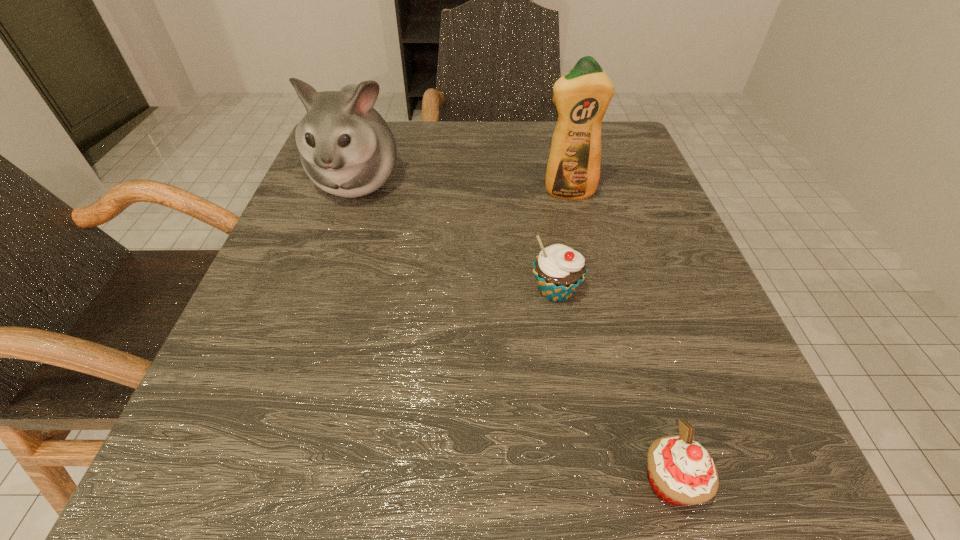
The width and height of the screenshot is (960, 540). Find the location of `vacant area between the shorter cupcake and the detergent`. vacant area between the shorter cupcake and the detergent is located at coordinates (619, 338).

Where is `free space between the third tallest object and the nearest object`? free space between the third tallest object and the nearest object is located at coordinates (613, 387).

Locate an element on the screen. vacant area that lies between the shortest object and the third shortest object is located at coordinates (514, 332).

Where is `vacant space that's between the shortest object and the second shortest object`? This screenshot has height=540, width=960. vacant space that's between the shortest object and the second shortest object is located at coordinates (613, 387).

Locate which object ranks second in proximity to the right cupcake. Please provide its 2D coordinates. Your answer should be formatted as a tuple, i.e. [(x, y)], where the tuple contains the x and y coordinates of a point satisfying the conditions above.

[(582, 96)]

Identify which object is the third nearest to the tallest object. Please provide its 2D coordinates. Your answer should be formatted as a tuple, i.e. [(x, y)], where the tuple contains the x and y coordinates of a point satisfying the conditions above.

[(681, 472)]

This screenshot has width=960, height=540. What are the coordinates of `free space that satisfies the following two spatial constraints: 1. on the label of the tallest object; 2. on the right side of the nearer cupcake` in the screenshot? It's located at (637, 482).

What are the coordinates of `vacant space that satisfies the following two spatial constraints: 1. on the face of the left cupcake; 2. on the right side of the third shortest object` in the screenshot? It's located at (320, 292).

Identify the location of free space in the image that satisfies the following two spatial constraints: 1. on the label of the nearest object; 2. on the right side of the tallest object. (637, 482).

Locate an element on the screen. This screenshot has width=960, height=540. blank space that satisfies the following two spatial constraints: 1. on the face of the second tallest object; 2. on the left side of the nearest object is located at coordinates pyautogui.click(x=254, y=482).